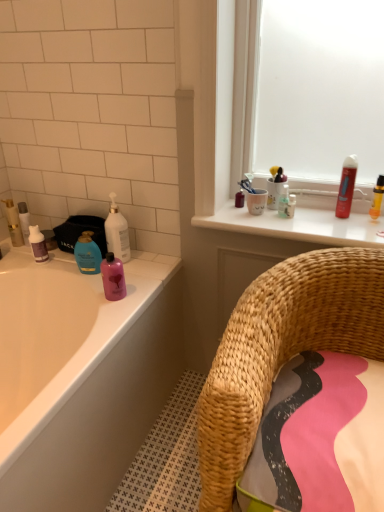
I want to click on unoccupied space behind pink glossy bottle at upper left, which appears as the second mouthwash when viewed from the right, so click(136, 271).